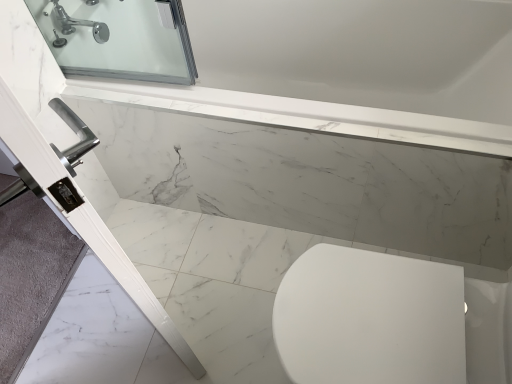
Identify the location of white glossy bathtub at lower left. This screenshot has width=512, height=384. (298, 206).

What do you see at coordinates (298, 206) in the screenshot?
I see `white glossy bathtub at lower left` at bounding box center [298, 206].

The image size is (512, 384). What do you see at coordinates (81, 24) in the screenshot?
I see `chrome metallic faucet at upper left` at bounding box center [81, 24].

Where is `chrome metallic faucet at upper left`? This screenshot has width=512, height=384. chrome metallic faucet at upper left is located at coordinates (81, 24).

You are a GUI agent. You are given a task and a screenshot of the screen. Output one action in this format:
    pyautogui.click(x=<x>, y=<y>)
    Task: Click on the white glossy bathtub at lower left
    The width and height of the screenshot is (512, 384).
    Given the screenshot: What is the action you would take?
    pyautogui.click(x=298, y=206)

Does chrome metallic faucet at upper left appear on the left side of white glossy bathtub at lower left?

Yes.

Which is in front, chrome metallic faucet at upper left or white glossy bathtub at lower left?

white glossy bathtub at lower left.

Considering the positions of point (66, 31) and point (298, 122), is point (66, 31) closer or farther from the camera than point (298, 122)?

Point (66, 31).

From the image's perspective, is chrome metallic faucet at upper left above or below white glossy bathtub at lower left?

chrome metallic faucet at upper left is above white glossy bathtub at lower left.

From a real-world perspective, which object stands above the other?

chrome metallic faucet at upper left, from a real-world perspective.

Considering the sizes of objects chrome metallic faucet at upper left and white glossy bathtub at lower left in the image provided, who is thinner, chrome metallic faucet at upper left or white glossy bathtub at lower left?

chrome metallic faucet at upper left.

Between chrome metallic faucet at upper left and white glossy bathtub at lower left, which one has more height?

chrome metallic faucet at upper left.

Between chrome metallic faucet at upper left and white glossy bathtub at lower left, which one has larger size?

With larger size is white glossy bathtub at lower left.

Is chrome metallic faucet at upper left completely or partially outside of white glossy bathtub at lower left?

Absolutely, chrome metallic faucet at upper left is external to white glossy bathtub at lower left.

Would you say chrome metallic faucet at upper left is a long distance from white glossy bathtub at lower left?

They are positioned close to each other.

Does chrome metallic faucet at upper left turn towards white glossy bathtub at lower left?

No, chrome metallic faucet at upper left is not turned towards white glossy bathtub at lower left.

How different are the orientations of chrome metallic faucet at upper left and white glossy bathtub at lower left in degrees?

The angle between the facing direction of chrome metallic faucet at upper left and the facing direction of white glossy bathtub at lower left is 180 degrees.

How far apart are chrome metallic faucet at upper left and white glossy bathtub at lower left?

A distance of 36.93 inches exists between chrome metallic faucet at upper left and white glossy bathtub at lower left.

Identify the location of tap located above the white glossy bathtub at lower left (from the image's perspective). Image resolution: width=512 pixels, height=384 pixels. (81, 24).

From the picture: Is white glossy bathtub at lower left to the right of chrome metallic faucet at upper left from the viewer's perspective?

Yes.

Does white glossy bathtub at lower left lie in front of chrome metallic faucet at upper left?

Yes, white glossy bathtub at lower left is in front of chrome metallic faucet at upper left.

Is point (346, 176) positioned in front of point (82, 20)?

Yes, point (346, 176) is closer to viewer.

From the image's perspective, is white glossy bathtub at lower left below chrome metallic faucet at upper left?

Yes.

From a real-world perspective, is white glossy bathtub at lower left physically located above or below chrome metallic faucet at upper left?

In terms of real-world spatial position, white glossy bathtub at lower left is below chrome metallic faucet at upper left.

Looking at this image, between white glossy bathtub at lower left and chrome metallic faucet at upper left, which one has smaller width?

With smaller width is chrome metallic faucet at upper left.

Who is taller, white glossy bathtub at lower left or chrome metallic faucet at upper left?

chrome metallic faucet at upper left is taller.

In terms of size, does white glossy bathtub at lower left appear bigger or smaller than chrome metallic faucet at upper left?

white glossy bathtub at lower left is bigger than chrome metallic faucet at upper left.

Do you think white glossy bathtub at lower left is within chrome metallic faucet at upper left, or outside of it?

The correct answer is: outside.

Are white glossy bathtub at lower left and chrome metallic faucet at upper left far apart?

white glossy bathtub at lower left is actually quite close to chrome metallic faucet at upper left.

Could you tell me if white glossy bathtub at lower left is turned towards chrome metallic faucet at upper left?

No, white glossy bathtub at lower left is not turned towards chrome metallic faucet at upper left.

How many degrees apart are the facing directions of white glossy bathtub at lower left and chrome metallic faucet at upper left?

There is a 180-degree angle between the facing directions of white glossy bathtub at lower left and chrome metallic faucet at upper left.

How much distance is there between white glossy bathtub at lower left and chrome metallic faucet at upper left?

36.93 inches.

Where is `bath located below the chrome metallic faucet at upper left (from the image's perspective)`? The height and width of the screenshot is (384, 512). bath located below the chrome metallic faucet at upper left (from the image's perspective) is located at coordinates tap(298, 206).

Locate an element on the screen. The height and width of the screenshot is (384, 512). bath in front of the chrome metallic faucet at upper left is located at coordinates (298, 206).

Where is `bath located underneath the chrome metallic faucet at upper left (from a real-world perspective)`? This screenshot has width=512, height=384. bath located underneath the chrome metallic faucet at upper left (from a real-world perspective) is located at coordinates (298, 206).